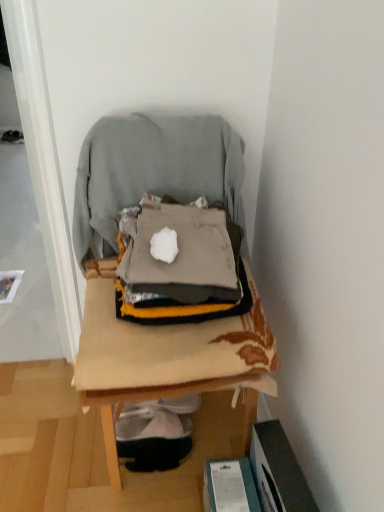
Question: From a real-world perspective, is gray fabric bean bag chair at center physically below wooden chair at center?

Choices:
 (A) yes
 (B) no

Answer: (B)

Question: Is gray fabric bean bag chair at center in front of wooden chair at center?

Choices:
 (A) yes
 (B) no

Answer: (B)

Question: Can you confirm if gray fabric bean bag chair at center is thinner than wooden chair at center?

Choices:
 (A) no
 (B) yes

Answer: (B)

Question: From the image's perspective, would you say gray fabric bean bag chair at center is shown under wooden chair at center?

Choices:
 (A) yes
 (B) no

Answer: (B)

Question: From the image's perspective, is gray fabric bean bag chair at center over wooden chair at center?

Choices:
 (A) no
 (B) yes

Answer: (B)

Question: Is gray fabric bean bag chair at center positioned beyond the bounds of wooden chair at center?

Choices:
 (A) no
 (B) yes

Answer: (A)

Question: From a real-world perspective, is wooden chair at center physically above gray fabric bean bag chair at center?

Choices:
 (A) no
 (B) yes

Answer: (A)

Question: Is wooden chair at center behind gray fabric bean bag chair at center?

Choices:
 (A) no
 (B) yes

Answer: (A)

Question: Is gray fabric bean bag chair at center inside wooden chair at center?

Choices:
 (A) yes
 (B) no

Answer: (A)

Question: Is the depth of wooden chair at center less than that of gray fabric bean bag chair at center?

Choices:
 (A) no
 (B) yes

Answer: (B)

Question: Is wooden chair at center with gray fabric bean bag chair at center?

Choices:
 (A) no
 (B) yes

Answer: (A)

Question: From a real-world perspective, does wooden chair at center sit lower than gray fabric bean bag chair at center?

Choices:
 (A) no
 (B) yes

Answer: (B)

Question: Considering the positions of gray fabric bean bag chair at center and wooden chair at center in the image, is gray fabric bean bag chair at center wider or thinner than wooden chair at center?

Choices:
 (A) wide
 (B) thin

Answer: (B)